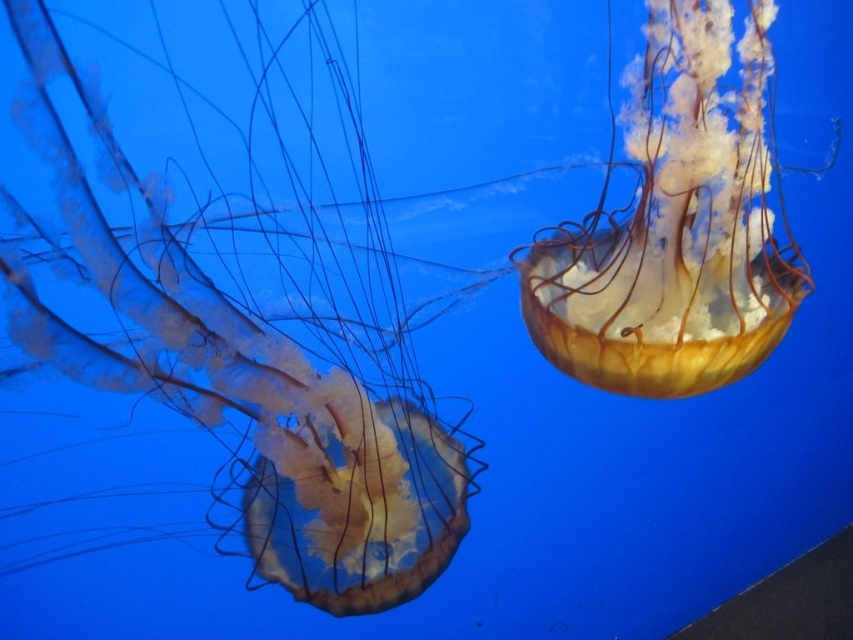
Question: Is translucent gelatinous at left closer to the viewer compared to translucent yellowish jellyfish at upper right?

Choices:
 (A) no
 (B) yes

Answer: (B)

Question: Which point is closer to the camera?

Choices:
 (A) translucent gelatinous at left
 (B) translucent yellowish jellyfish at upper right

Answer: (A)

Question: Among these objects, which one is nearest to the camera?

Choices:
 (A) translucent yellowish jellyfish at upper right
 (B) translucent gelatinous at left

Answer: (B)

Question: In this image, where is translucent gelatinous at left located relative to translucent yellowish jellyfish at upper right?

Choices:
 (A) above
 (B) below

Answer: (B)

Question: Among these points, which one is nearest to the camera?

Choices:
 (A) (312, 13)
 (B) (674, 349)

Answer: (A)

Question: Can you confirm if translucent gelatinous at left is positioned below translucent yellowish jellyfish at upper right?

Choices:
 (A) no
 (B) yes

Answer: (B)